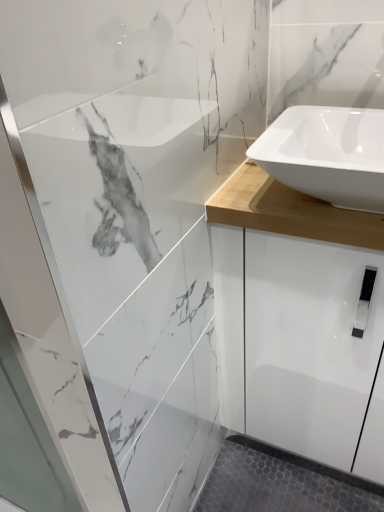
Where is `white glossy sink at upper right`? The height and width of the screenshot is (512, 384). white glossy sink at upper right is located at coordinates (327, 154).

The image size is (384, 512). What do you see at coordinates (327, 154) in the screenshot?
I see `white glossy sink at upper right` at bounding box center [327, 154].

The height and width of the screenshot is (512, 384). I want to click on white glossy sink at upper right, so click(327, 154).